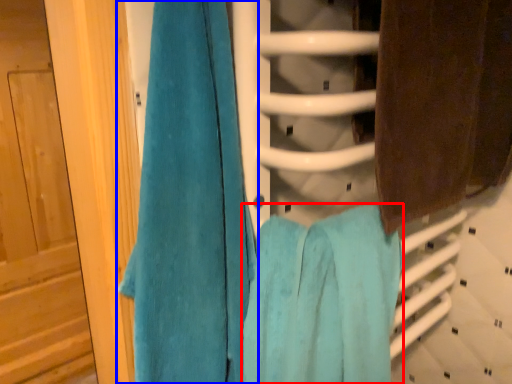
Question: Which of the following is the closest to the observer, towel (highlighted by a red box) or towel (highlighted by a blue box)?

Choices:
 (A) towel
 (B) towel

Answer: (B)